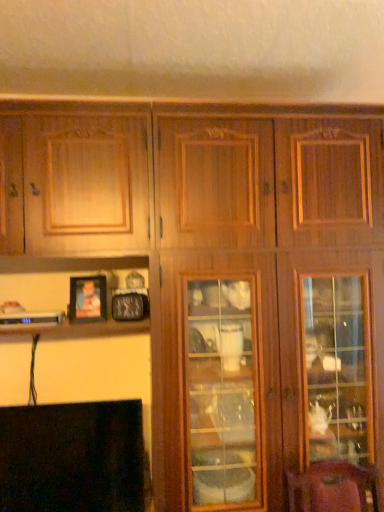
Question: From a real-world perspective, is black glossy fireplace at lower left under wooden photo frame at lower left?

Choices:
 (A) no
 (B) yes

Answer: (B)

Question: From a real-world perspective, is black glossy fireplace at lower left physically above wooden photo frame at lower left?

Choices:
 (A) yes
 (B) no

Answer: (B)

Question: Is black glossy fireplace at lower left further to the viewer compared to wooden photo frame at lower left?

Choices:
 (A) no
 (B) yes

Answer: (A)

Question: Is wooden photo frame at lower left inside black glossy fireplace at lower left?

Choices:
 (A) no
 (B) yes

Answer: (A)

Question: Considering the relative sizes of black glossy fireplace at lower left and wooden photo frame at lower left in the image provided, is black glossy fireplace at lower left bigger than wooden photo frame at lower left?

Choices:
 (A) no
 (B) yes

Answer: (B)

Question: Is black glossy fireplace at lower left directly adjacent to wooden photo frame at lower left?

Choices:
 (A) yes
 (B) no

Answer: (B)

Question: Is wooden photo frame at lower left completely or partially outside of black glossy fireplace at lower left?

Choices:
 (A) no
 (B) yes

Answer: (B)

Question: Does wooden photo frame at lower left lie in front of black glossy fireplace at lower left?

Choices:
 (A) no
 (B) yes

Answer: (A)

Question: From a real-world perspective, is wooden photo frame at lower left positioned over black glossy fireplace at lower left based on gravity?

Choices:
 (A) yes
 (B) no

Answer: (A)

Question: Is there a large distance between wooden photo frame at lower left and black glossy fireplace at lower left?

Choices:
 (A) yes
 (B) no

Answer: (B)

Question: Is black glossy fireplace at lower left surrounded by wooden photo frame at lower left?

Choices:
 (A) yes
 (B) no

Answer: (B)

Question: Is wooden photo frame at lower left aimed at black glossy fireplace at lower left?

Choices:
 (A) yes
 (B) no

Answer: (B)

Question: Is wooden photo frame at lower left taller or shorter than black glossy fireplace at lower left?

Choices:
 (A) tall
 (B) short

Answer: (B)